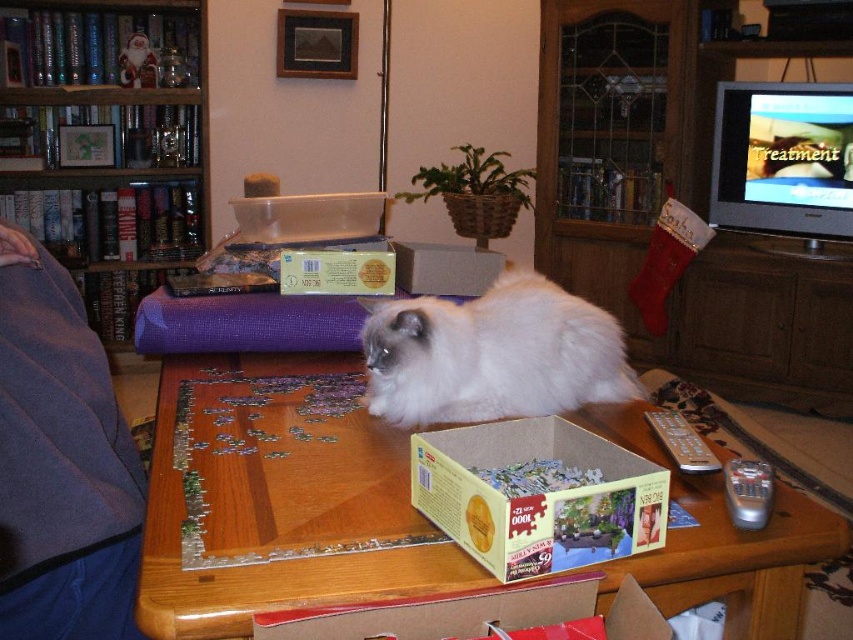
You are trying to place a new decorative item on the wooden bookshelf at upper left and the white fluffy cat at center. Which surface has more space available for placing items?

The wooden bookshelf at upper left has more space available because it is wider than the white fluffy cat at center.

You are a robotic vacuum cleaner with a diameter of 35 centimeters. You are currently positioned near the bookshelf in the living room and want to move to the open puzzle box at center. Is there enough space between the white fluffy cat at center and the cardboard box at center for you to pass through?

The distance between the white fluffy cat at center and the cardboard box at center is 49.10 centimeters. Since the robotic vacuum cleaner has a diameter of 35 centimeters, it can fit through the space as 35 cm is less than 49.10 cm.